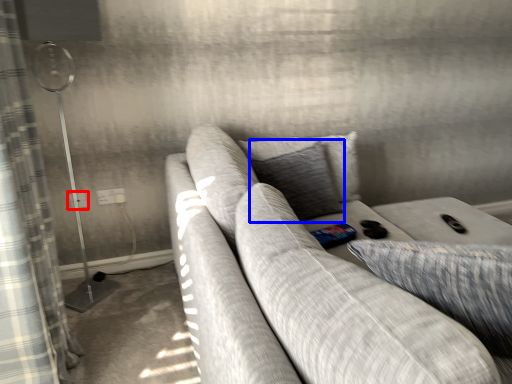
Question: Which object appears farthest to the camera in this image, electric outlet (highlighted by a red box) or pillow (highlighted by a blue box)?

Choices:
 (A) electric outlet
 (B) pillow

Answer: (A)